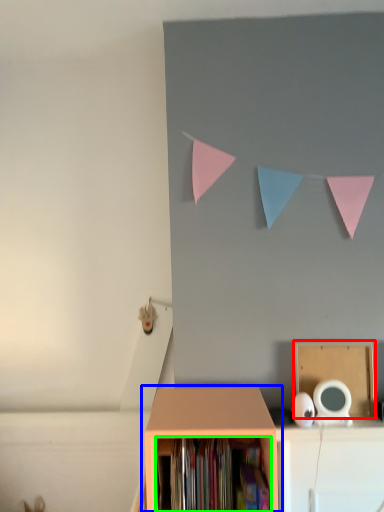
Question: Estimate the real-world distances between objects in this image. Which object is farther from cardboard box (highlighted by a red box), shelf (highlighted by a blue box) or book (highlighted by a green box)?

Choices:
 (A) shelf
 (B) book

Answer: (B)